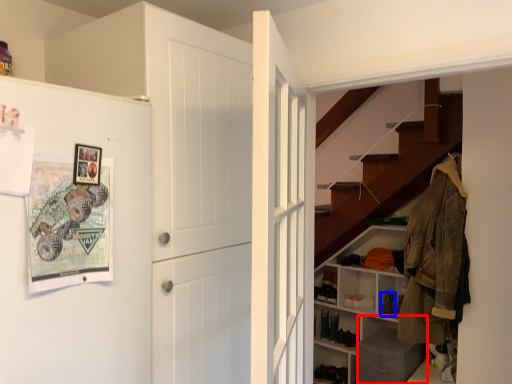
Question: Which point is further to the camera, shelf (highlighted by a red box) or shoe (highlighted by a blue box)?

Choices:
 (A) shelf
 (B) shoe

Answer: (B)